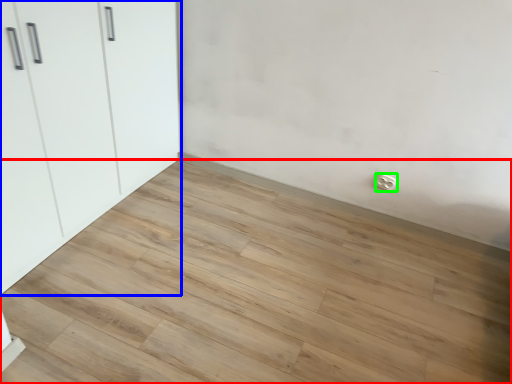
Question: Which object is positioned farthest from plank (highlighted by a red box)? Select from cupboard (highlighted by a blue box) and electric outlet (highlighted by a green box).

Choices:
 (A) cupboard
 (B) electric outlet

Answer: (B)